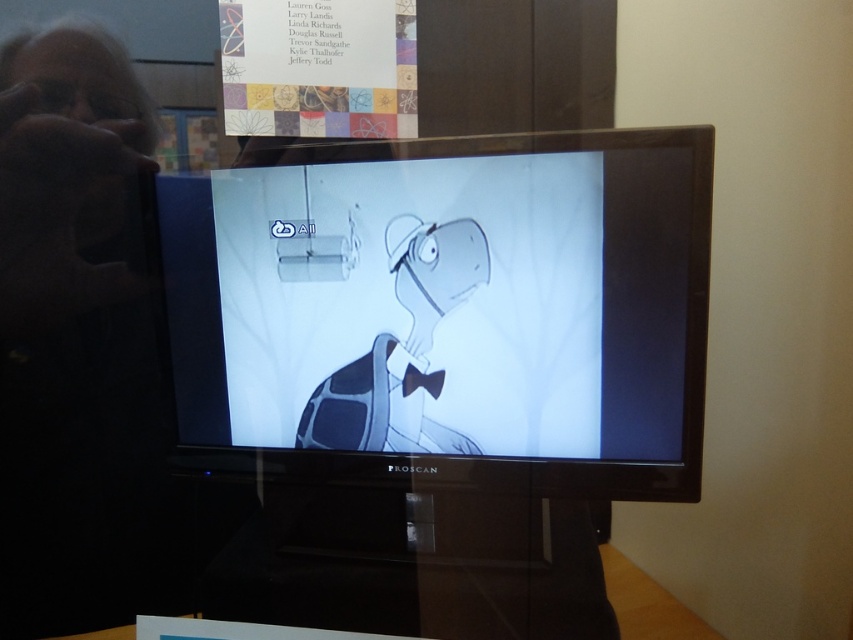
Question: Which point is closer to the camera?

Choices:
 (A) gray matte turtle at center
 (B) matte black screen at center

Answer: (B)

Question: Which of the following is the closest to the observer?

Choices:
 (A) (483, 234)
 (B) (328, 275)

Answer: (A)

Question: Does matte black screen at center have a lesser width compared to gray matte turtle at center?

Choices:
 (A) yes
 (B) no

Answer: (B)

Question: Can you confirm if matte black screen at center is positioned to the right of gray matte turtle at center?

Choices:
 (A) yes
 (B) no

Answer: (A)

Question: From the image, what is the correct spatial relationship of matte black screen at center in relation to gray matte turtle at center?

Choices:
 (A) above
 (B) below

Answer: (A)

Question: Which point is closer to the camera?

Choices:
 (A) matte black screen at center
 (B) gray matte turtle at center

Answer: (A)